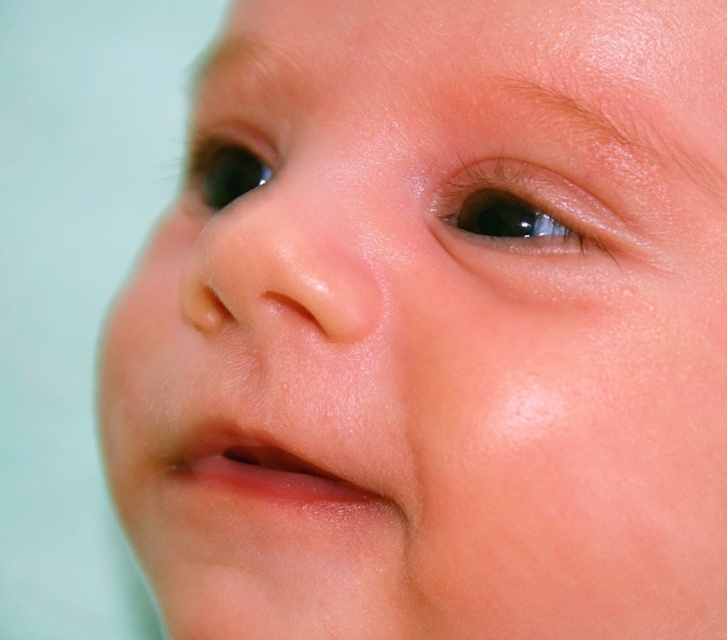
Is glossy brown eye at upper center above black glossy eye at upper left?

No, glossy brown eye at upper center is not above black glossy eye at upper left.

Looking at this image, who is lower down, glossy brown eye at upper center or black glossy eye at upper left?

glossy brown eye at upper center

Who is more distant from viewer, (627, 234) or (257, 179)?

Positioned behind is point (257, 179).

This screenshot has width=727, height=640. I want to click on glossy brown eye at upper center, so click(x=531, y=218).